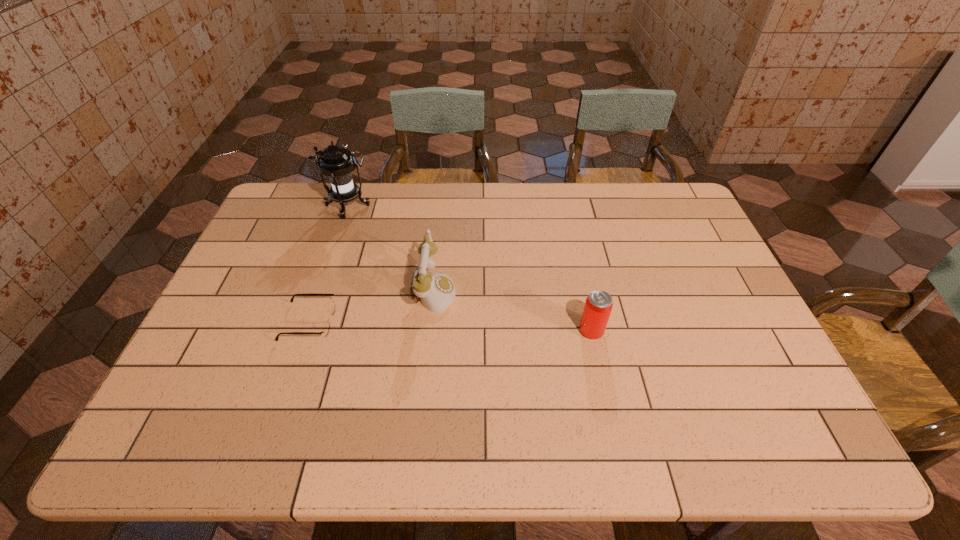
Identify the location of vacant space located at the hinge ends of the spectacles. The image size is (960, 540). (442, 322).

I want to click on object that is at the far edge, so click(x=336, y=162).

I want to click on vacant space at the far edge of the desktop, so click(x=366, y=221).

Image resolution: width=960 pixels, height=540 pixels. In the image, there is a desktop. Identify the location of vacant space at the near edge. point(443,431).

In the image, there is a desktop. Where is `vacant region at the left edge`? This screenshot has width=960, height=540. vacant region at the left edge is located at coordinates (263, 280).

In order to click on free space at the right edge of the desktop in this screenshot , I will do `click(671, 234)`.

In the image, there is a desktop. In order to click on free space at the far left corner in this screenshot , I will do `click(319, 183)`.

Find the location of a particular element. The height and width of the screenshot is (540, 960). blank region between the third object from left to right and the rightmost object is located at coordinates (513, 310).

Locate an element on the screen. Image resolution: width=960 pixels, height=540 pixels. free point between the shortest object and the telephone is located at coordinates (372, 307).

The image size is (960, 540). I want to click on free spot between the rightmost object and the tallest object, so click(x=469, y=268).